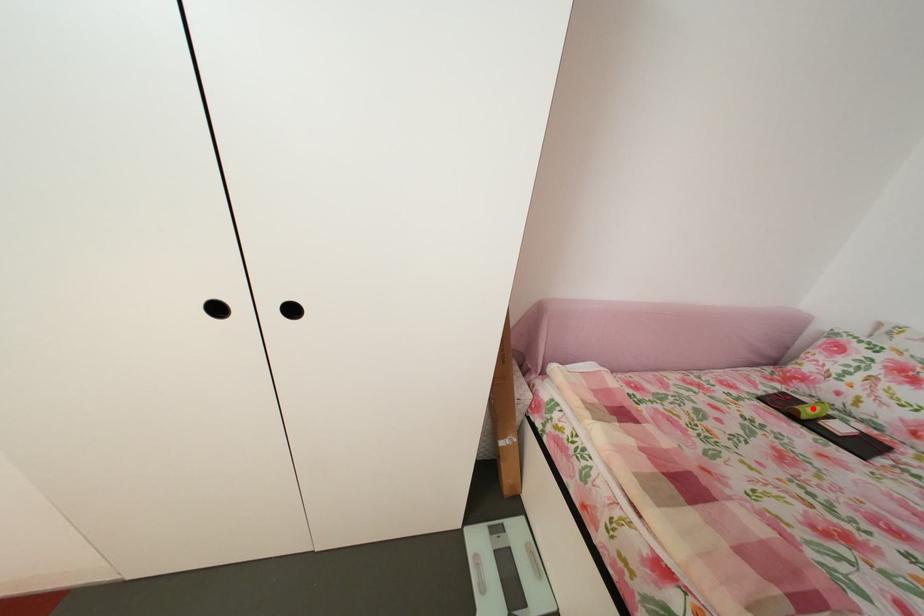
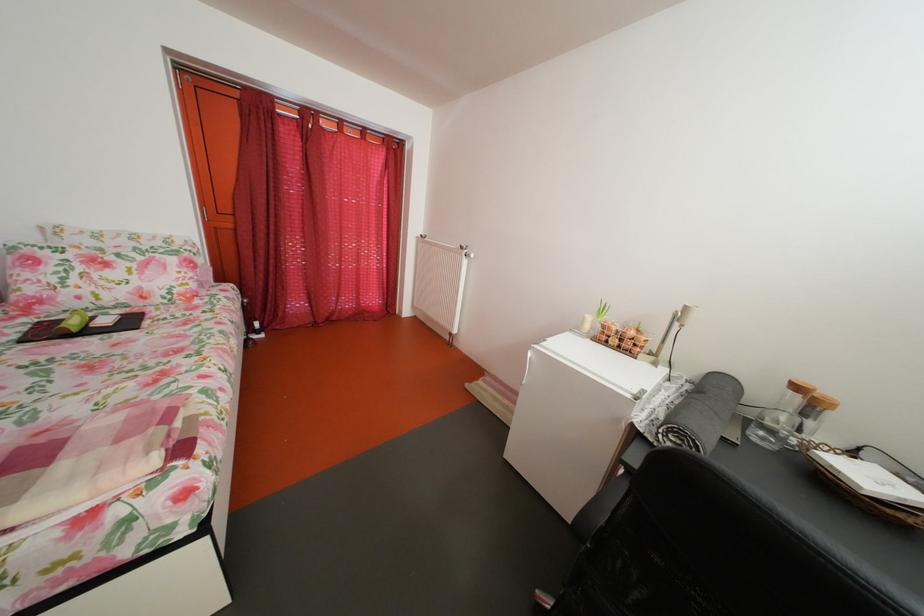
Find the pixel in the second image that matches the highlighted location in the first image.

(73, 326)